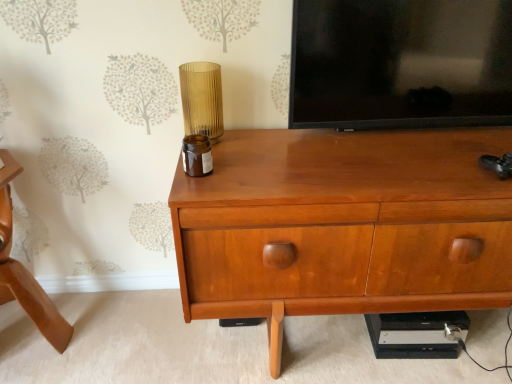
Measure the distance between point (194, 133) and camera.

4.61 feet.

Find the location of `translucent amber glass at center`. translucent amber glass at center is located at coordinates (202, 99).

What do you see at coordinates (344, 226) in the screenshot?
I see `wooden chest of drawers at center` at bounding box center [344, 226].

Where is `translucent amber glass at center`? translucent amber glass at center is located at coordinates (202, 99).

From the image's perspective, relative to black glossy tv at upper center, is wooden chest of drawers at center above or below?

Clearly, from the image's perspective, wooden chest of drawers at center is below black glossy tv at upper center.

Based on their sizes in the image, would you say wooden chest of drawers at center is bigger or smaller than black glossy tv at upper center?

Clearly, wooden chest of drawers at center is larger in size than black glossy tv at upper center.

Relative to black glossy tv at upper center, is wooden chest of drawers at center in front or behind?

Clearly, wooden chest of drawers at center is in front of black glossy tv at upper center.

Locate an element on the screen. Image resolution: width=512 pixels, height=384 pixels. television that appears above the wooden chest of drawers at center (from the image's perspective) is located at coordinates (401, 63).

From the image's perspective, which is above, translucent amber glass at center or wooden chest of drawers at center?

From the image's view, translucent amber glass at center is above.

In the scene shown: What's the angular difference between translucent amber glass at center and wooden chest of drawers at center's facing directions?

The angular difference between translucent amber glass at center and wooden chest of drawers at center is 0.71 degrees.

Considering the points (219, 103) and (346, 186), which point is behind, point (219, 103) or point (346, 186)?

The point (219, 103) is more distant.

How far apart are translucent amber glass at center and wooden chest of drawers at center?

A distance of 19.86 inches exists between translucent amber glass at center and wooden chest of drawers at center.

In the scene shown: Is wooden chair at lower left turned away from wooden chest of drawers at center?

No, wooden chair at lower left is not facing away from wooden chest of drawers at center.

From the image's perspective, between wooden chair at lower left and wooden chest of drawers at center, which one is located above?

wooden chest of drawers at center, from the image's perspective.

Which is more to the right, wooden chair at lower left or wooden chest of drawers at center?

wooden chest of drawers at center is more to the right.

Is wooden chair at lower left beside wooden chest of drawers at center?

No, wooden chair at lower left is not in contact with wooden chest of drawers at center.

From the picture: Is wooden chair at lower left oriented away from black glossy tv at upper center?

wooden chair at lower left does not have its back to black glossy tv at upper center.

Does wooden chair at lower left have a greater width compared to black glossy tv at upper center?

Yes, wooden chair at lower left is wider than black glossy tv at upper center.

In terms of size, does wooden chair at lower left appear bigger or smaller than black glossy tv at upper center?

In the image, wooden chair at lower left appears to be larger than black glossy tv at upper center.

Does wooden chair at lower left have a greater height compared to black glossy tv at upper center?

Yes, wooden chair at lower left is taller than black glossy tv at upper center.

Which object is more forward, wooden chair at lower left or translucent amber glass at center?

wooden chair at lower left is closer to the camera.

In the scene shown: Would you say wooden chair at lower left is to the left or to the right of translucent amber glass at center in the picture?

wooden chair at lower left is positioned on translucent amber glass at center's left side.

From a real-world perspective, which is physically below, wooden chair at lower left or translucent amber glass at center?

wooden chair at lower left, from a real-world perspective.

From the image's perspective, is wooden chair at lower left on translucent amber glass at center?

No, from the image's perspective, wooden chair at lower left is not over translucent amber glass at center.

Considering the sizes of objects translucent amber glass at center and black glossy tv at upper center in the image provided, who is shorter, translucent amber glass at center or black glossy tv at upper center?

Standing shorter between the two is translucent amber glass at center.

Considering the relative sizes of translucent amber glass at center and black glossy tv at upper center in the image provided, is translucent amber glass at center thinner than black glossy tv at upper center?

In fact, translucent amber glass at center might be wider than black glossy tv at upper center.

Between translucent amber glass at center and black glossy tv at upper center, which one has smaller size?

Smaller between the two is translucent amber glass at center.

Find the location of `television above the translucent amber glass at center (from a real-world perspective)`. television above the translucent amber glass at center (from a real-world perspective) is located at coordinates (401, 63).

Which of these two, black glossy tv at upper center or wooden chair at lower left, is smaller?

With smaller size is black glossy tv at upper center.

Is black glossy tv at upper center completely or partially outside of wooden chair at lower left?

Yes.

From the image's perspective, would you say black glossy tv at upper center is positioned over wooden chair at lower left?

Yes, from the image's perspective, black glossy tv at upper center is over wooden chair at lower left.

Is black glossy tv at upper center beside wooden chair at lower left?

There is a gap between black glossy tv at upper center and wooden chair at lower left.

At what (x,y) coordinates should I click in order to perform the action: click on chest of drawers on the left of black glossy tv at upper center. Please return your answer as a coordinate pair (x, y). The width and height of the screenshot is (512, 384). Looking at the image, I should click on (344, 226).

Locate an element on the screen. The width and height of the screenshot is (512, 384). chest of drawers on the right of the translucent amber glass at center is located at coordinates (344, 226).

Considering their positions, is wooden chest of drawers at center positioned further to translucent amber glass at center than black glossy tv at upper center?

wooden chest of drawers at center is positioned further to the anchor translucent amber glass at center.

From the image, which object appears to be farther from wooden chair at lower left, translucent amber glass at center or black glossy tv at upper center?

black glossy tv at upper center is positioned further to the anchor wooden chair at lower left.

Considering their positions, is wooden chair at lower left positioned closer to black glossy tv at upper center than wooden chest of drawers at center?

The object closer to black glossy tv at upper center is wooden chest of drawers at center.

Considering their positions, is black glossy tv at upper center positioned further to wooden chest of drawers at center than wooden chair at lower left?

wooden chair at lower left lies further to wooden chest of drawers at center than the other object.

When comparing their distances from black glossy tv at upper center, does wooden chest of drawers at center or translucent amber glass at center seem closer?

wooden chest of drawers at center is positioned closer to the anchor black glossy tv at upper center.

From the image, which object appears to be farther from wooden chest of drawers at center, wooden chair at lower left or black glossy tv at upper center?

wooden chair at lower left is positioned further to the anchor wooden chest of drawers at center.

Considering their positions, is wooden chair at lower left positioned closer to wooden chest of drawers at center than translucent amber glass at center?

The object closer to wooden chest of drawers at center is translucent amber glass at center.

From the image, which object appears to be farther from translucent amber glass at center, black glossy tv at upper center or wooden chair at lower left?

wooden chair at lower left is further to translucent amber glass at center.

Find the location of a particular element. The image size is (512, 384). table lamp situated between wooden chair at lower left and wooden chest of drawers at center from left to right is located at coordinates (202, 99).

You are a GUI agent. You are given a task and a screenshot of the screen. Output one action in this format:
    pyautogui.click(x=<x>, y=<y>)
    Task: Click on the chest of drawers between wooden chair at lower left and black glossy tv at upper center in the horizontal direction
    The image size is (512, 384).
    Given the screenshot: What is the action you would take?
    pyautogui.click(x=344, y=226)

Locate an element on the screen. Image resolution: width=512 pixels, height=384 pixels. table lamp between wooden chair at lower left and black glossy tv at upper center from left to right is located at coordinates (202, 99).

Where is `the chest of drawers located between translucent amber glass at center and black glossy tv at upper center in the left-right direction`? the chest of drawers located between translucent amber glass at center and black glossy tv at upper center in the left-right direction is located at coordinates (344, 226).